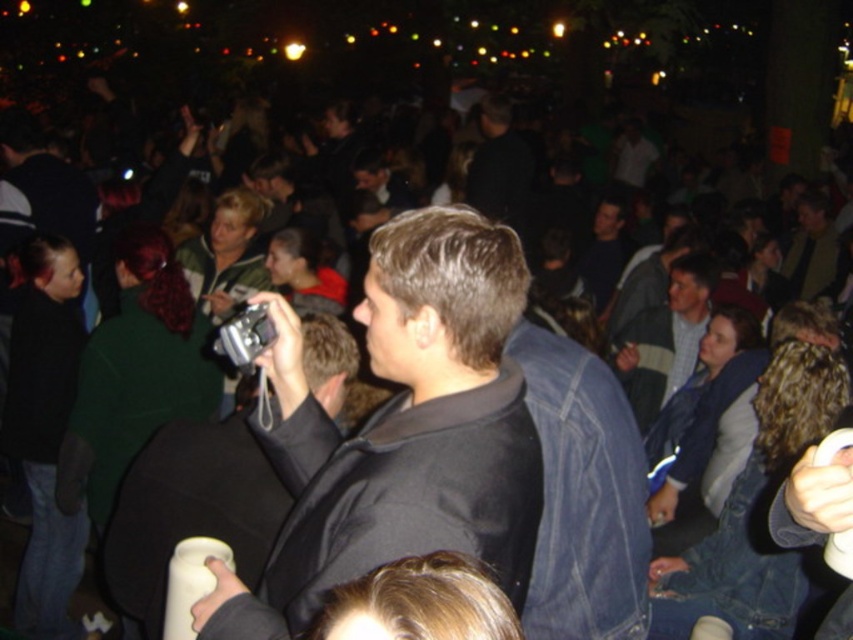
Is light gray sweater at center bigger than dark blue shirt at center?

Actually, light gray sweater at center might be smaller than dark blue shirt at center.

The height and width of the screenshot is (640, 853). What do you see at coordinates (664, 339) in the screenshot?
I see `light gray sweater at center` at bounding box center [664, 339].

You are a GUI agent. You are given a task and a screenshot of the screen. Output one action in this format:
    pyautogui.click(x=<x>, y=<y>)
    Task: Click on the light gray sweater at center
    
    Given the screenshot: What is the action you would take?
    pyautogui.click(x=664, y=339)

From the picture: Is black matte jacket at center positioned behind light gray sweater at center?

No, black matte jacket at center is closer to the viewer.

Does black matte jacket at center appear on the right side of light gray sweater at center?

No, black matte jacket at center is not to the right of light gray sweater at center.

Is point (506, 492) less distant than point (624, 356)?

Yes.

This screenshot has height=640, width=853. Find the location of `black matte jacket at center`. black matte jacket at center is located at coordinates (401, 429).

Who is lower down, black matte jacket at center or dark blue shirt at center?

black matte jacket at center

Is point (347, 531) in front of point (511, 189)?

Yes, point (347, 531) is in front of point (511, 189).

Locate an element on the screen. The image size is (853, 640). black matte jacket at center is located at coordinates (401, 429).